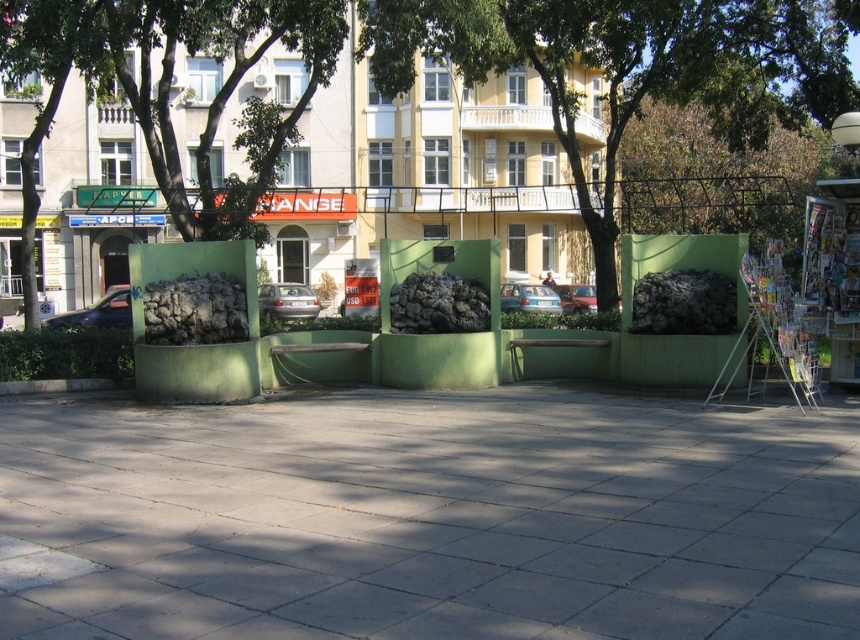
You are a city planner assessing the plaza layout. You need to install a new streetlight that must be at least 3 meters tall to comply with safety regulations. Based on the scene, can the gray concrete pavement at center and the green leafy tree at center help determine if the proposed streetlight will meet the height requirement?

The green leafy tree at center is taller than the gray concrete pavement at center. Since the tree is taller than the pavement, and the pavement itself is part of the plaza ground, the tree likely exceeds the 3 meter requirement. Therefore, the proposed streetlight should be installed to match or exceed the tree height to meet regulations.

You are standing at the point labeled point (401,470) and want to walk to the point labeled point (612,141). Based on the scene description, will you have to walk towards or away from the trees in the background?

Since point (401,470) is in front of point (612,141), you are already closer to the trees in the background. Therefore, to reach point (612,141), you would need to walk away from the trees.